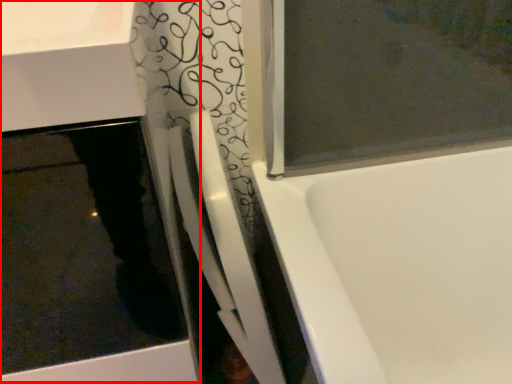
Question: From the image's perspective, what is the correct spatial positioning of sink (annotated by the red box) in reference to shower door?

Choices:
 (A) above
 (B) below

Answer: (B)